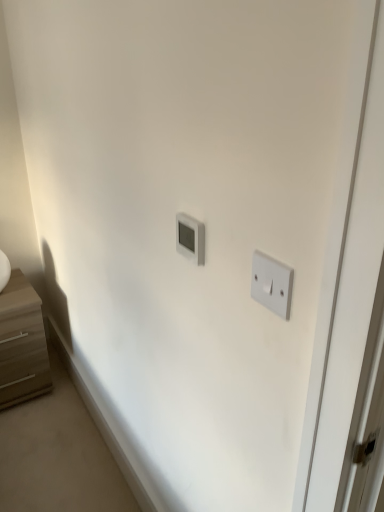
Question: Does light brown wood chest of drawers at left touch white plastic thermostat at center, acting as the first light switch starting from the left?

Choices:
 (A) no
 (B) yes

Answer: (A)

Question: Is light brown wood chest of drawers at left positioned before white plastic thermostat at center, arranged as the 2th light switch when viewed from the right?

Choices:
 (A) yes
 (B) no

Answer: (B)

Question: Is light brown wood chest of drawers at left thinner than white plastic thermostat at center, the 2th light switch viewed from the front?

Choices:
 (A) no
 (B) yes

Answer: (A)

Question: Considering the relative sizes of light brown wood chest of drawers at left and white plastic thermostat at center, the 2th light switch viewed from the front, in the image provided, is light brown wood chest of drawers at left taller than white plastic thermostat at center, the 2th light switch viewed from the front,?

Choices:
 (A) no
 (B) yes

Answer: (B)

Question: Is light brown wood chest of drawers at left aimed at white plastic thermostat at center, acting as the first light switch starting from the left?

Choices:
 (A) no
 (B) yes

Answer: (A)

Question: Choose the correct answer: Is light brown wood chest of drawers at left inside white plastic thermostat at center, which is the first light switch from back to front, or outside it?

Choices:
 (A) outside
 (B) inside

Answer: (A)

Question: From the image's perspective, is light brown wood chest of drawers at left above or below white plastic thermostat at center, arranged as the 2th light switch when viewed from the right?

Choices:
 (A) above
 (B) below

Answer: (B)

Question: Considering the positions of light brown wood chest of drawers at left and white plastic thermostat at center, the 2th light switch viewed from the front, in the image, is light brown wood chest of drawers at left bigger or smaller than white plastic thermostat at center, the 2th light switch viewed from the front,?

Choices:
 (A) big
 (B) small

Answer: (A)

Question: From a real-world perspective, is light brown wood chest of drawers at left above or below white plastic thermostat at center, which is the first light switch from back to front?

Choices:
 (A) below
 (B) above

Answer: (A)

Question: From the image's perspective, is white plastic thermostat at center, acting as the first light switch starting from the left, located above or below white plastic light switch at right, which appears as the 2th light switch when viewed from the left?

Choices:
 (A) above
 (B) below

Answer: (A)

Question: Is point (178, 238) closer or farther from the camera than point (258, 294)?

Choices:
 (A) farther
 (B) closer

Answer: (A)

Question: Is white plastic thermostat at center, arranged as the 2th light switch when viewed from the right, wider or thinner than white plastic light switch at right, placed as the 1th light switch when sorted from front to back?

Choices:
 (A) thin
 (B) wide

Answer: (B)

Question: Would you say white plastic thermostat at center, the 2th light switch viewed from the front, is to the left or to the right of white plastic light switch at right, marked as the second light switch in a back-to-front arrangement, in the picture?

Choices:
 (A) left
 (B) right

Answer: (A)

Question: Looking at their shapes, would you say white plastic light switch at right, placed as the 1th light switch when sorted from front to back, is wider or thinner than white plastic thermostat at center, arranged as the 2th light switch when viewed from the right?

Choices:
 (A) wide
 (B) thin

Answer: (B)

Question: From a real-world perspective, is white plastic light switch at right, marked as the second light switch in a back-to-front arrangement, above or below white plastic thermostat at center, the 2th light switch viewed from the front?

Choices:
 (A) above
 (B) below

Answer: (A)